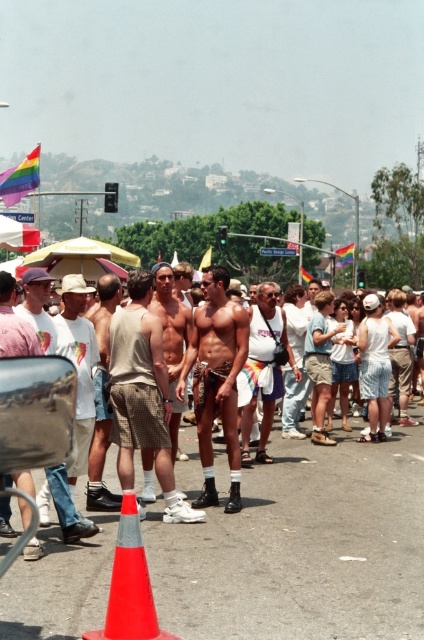
Question: Is tan shorts at center above matte pink shirt at center?

Choices:
 (A) no
 (B) yes

Answer: (B)

Question: Which of the following is the closest to the observer?

Choices:
 (A) 275,352
 (B) 28,336
 (C) 58,353
 (D) 123,552

Answer: (D)

Question: Can you confirm if brown leather belt at center is smaller than orange plastic traffic cone at lower center?

Choices:
 (A) yes
 (B) no

Answer: (A)

Question: Which object is the closest to the matte pink shirt at center?

Choices:
 (A) white fabric shorts at center
 (B) tan shorts at center

Answer: (B)

Question: Which object is closer to the camera taking this photo?

Choices:
 (A) brown leather belt at center
 (B) tan shorts at center
 (C) orange plastic traffic cone at lower center

Answer: (C)

Question: Does brown leather belt at center come in front of orange plastic traffic cone at lower center?

Choices:
 (A) yes
 (B) no

Answer: (B)